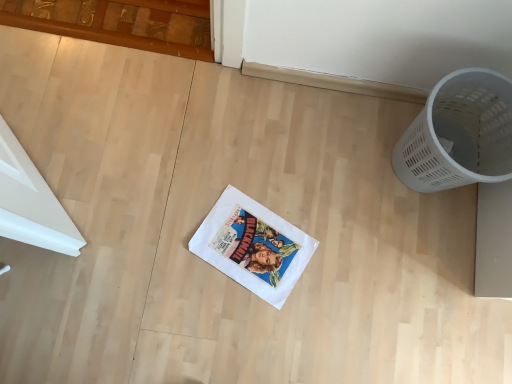
At what (x,y) coordinates should I click in order to perform the action: click on free spot above white paper comic book at center (from a real-world perspective). Please return your answer as a coordinate pair (x, y). Looking at the image, I should click on (251, 248).